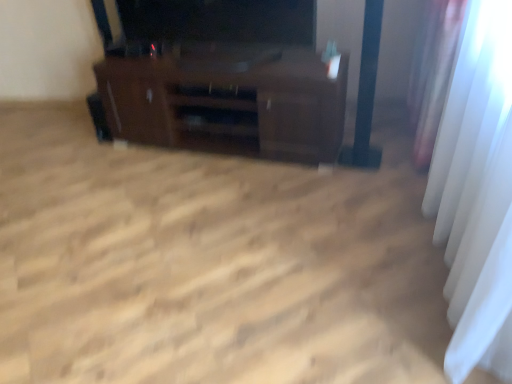
I want to click on vacant area that lies in front of dark brown wood tv stand at center, so click(x=217, y=229).